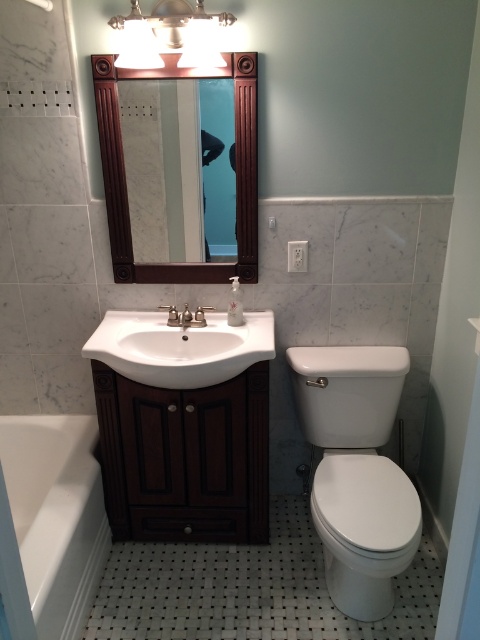
You are standing in the bathroom and notice two points marked on the wall. The first point is at coordinate point (80,540) and the second is at point (365,497). Which point is closer to your current position?

Point (80,540) is closer to the viewer than point (365,497).

You are standing in the bathroom and want to take a photo of the white glossy toilet at lower right without the mahogany wood mirror at upper center appearing in the shot. Is this possible based on their positions?

The white glossy toilet at lower right is in front of the mahogany wood mirror at upper center, so the mirror would be behind the toilet from your perspective. Therefore, you can take a photo of the white glossy toilet at lower right without the mirror appearing in the shot by positioning yourself so the toilet blocks the mirror from view.